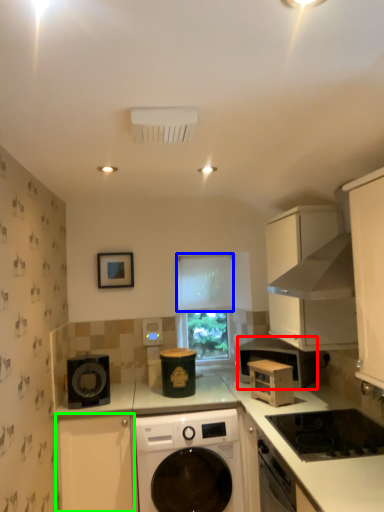
Question: Estimate the real-world distances between objects in this image. Which object is closer to home appliance (highlighted by a red box), curtain (highlighted by a blue box) or cabinetry (highlighted by a green box)?

Choices:
 (A) curtain
 (B) cabinetry

Answer: (A)